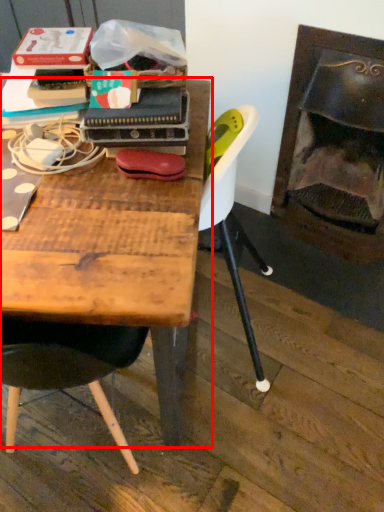
Question: In this image, where is table (annotated by the red box) located relative to fireplace?

Choices:
 (A) right
 (B) left

Answer: (B)